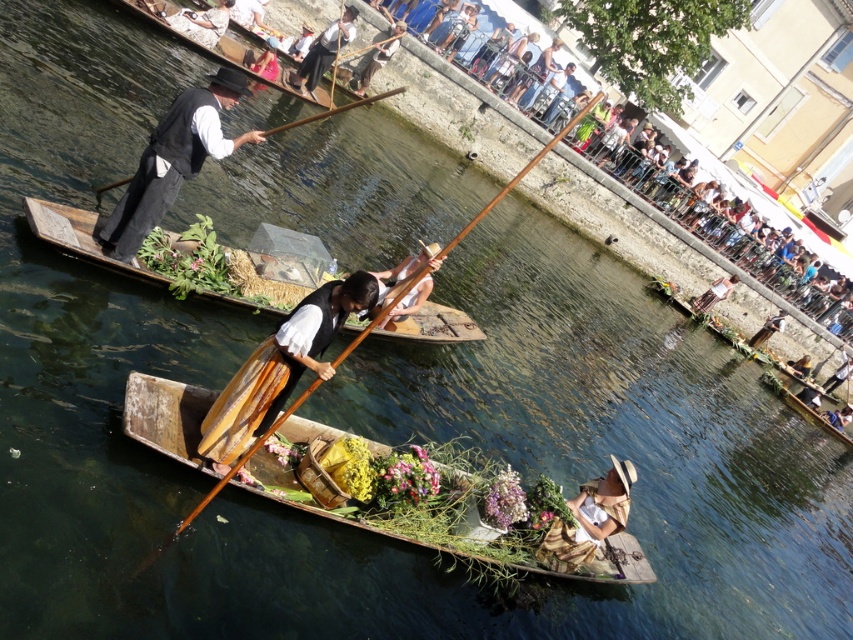
Question: Can you confirm if camouflage fabric hat at lower right is smaller than matte black hat at upper center?

Choices:
 (A) yes
 (B) no

Answer: (B)

Question: Can you confirm if wooden canoe at center is positioned to the left of matte black paddle at center?

Choices:
 (A) yes
 (B) no

Answer: (A)

Question: Among these objects, which one is nearest to the camera?

Choices:
 (A) camouflage fabric hat at lower right
 (B) matte black hat at upper center
 (C) wooden paddle at upper center

Answer: (A)

Question: Among these points, which one is nearest to the camera?

Choices:
 (A) (694, 310)
 (B) (317, 512)
 (C) (149, 173)

Answer: (B)

Question: Which object appears closest to the camera in this image?

Choices:
 (A) wooden paddle at upper center
 (B) wooden at left

Answer: (B)

Question: Can you confirm if camouflage fabric hat at lower right is thinner than matte black paddle at center?

Choices:
 (A) yes
 (B) no

Answer: (B)